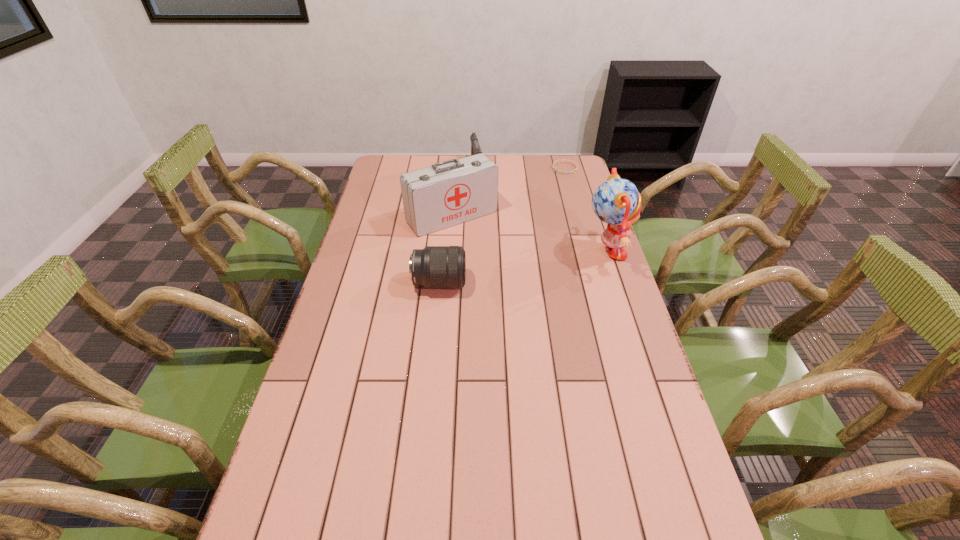
What are the coordinates of `free space between the gun and the tallest object` in the screenshot? It's located at (540, 210).

Identify the location of vacant area that lies between the telephoto lens and the tallest object. (522, 268).

The height and width of the screenshot is (540, 960). I want to click on empty location between the telephoto lens and the shortest object, so click(x=502, y=226).

Locate which object is the third closest to the fourth shortest object. Please provide its 2D coordinates. Your answer should be formatted as a tuple, i.e. [(x, y)], where the tuple contains the x and y coordinates of a point satisfying the conditions above.

[(617, 202)]

Identify which object is the third nearest to the doll. Please provide its 2D coordinates. Your answer should be formatted as a tuple, i.e. [(x, y)], where the tuple contains the x and y coordinates of a point satisfying the conditions above.

[(435, 267)]

Image resolution: width=960 pixels, height=540 pixels. In order to click on free region that satisfies the following two spatial constraints: 1. on the front side of the bracelet; 2. on the face of the tallest object in this screenshot , I will do `click(588, 253)`.